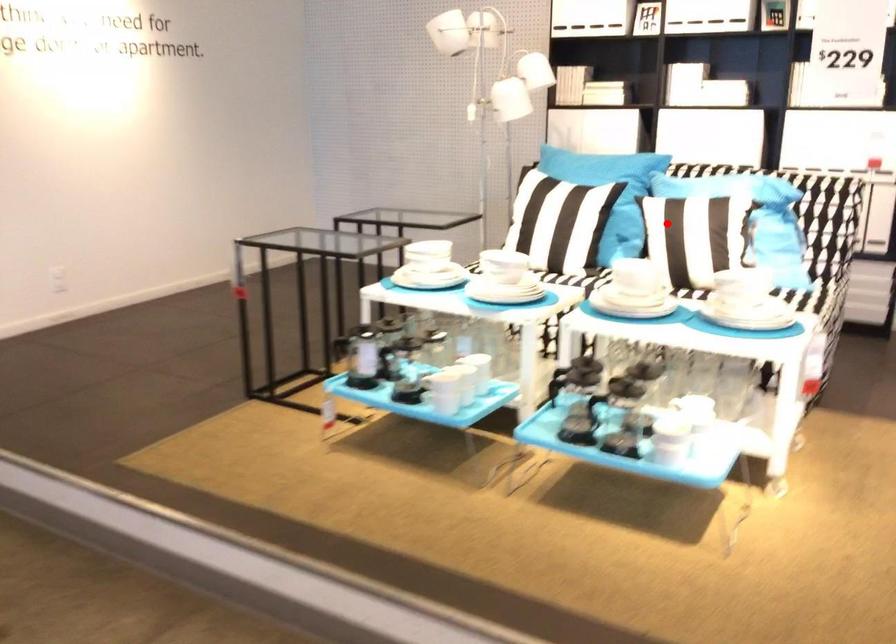
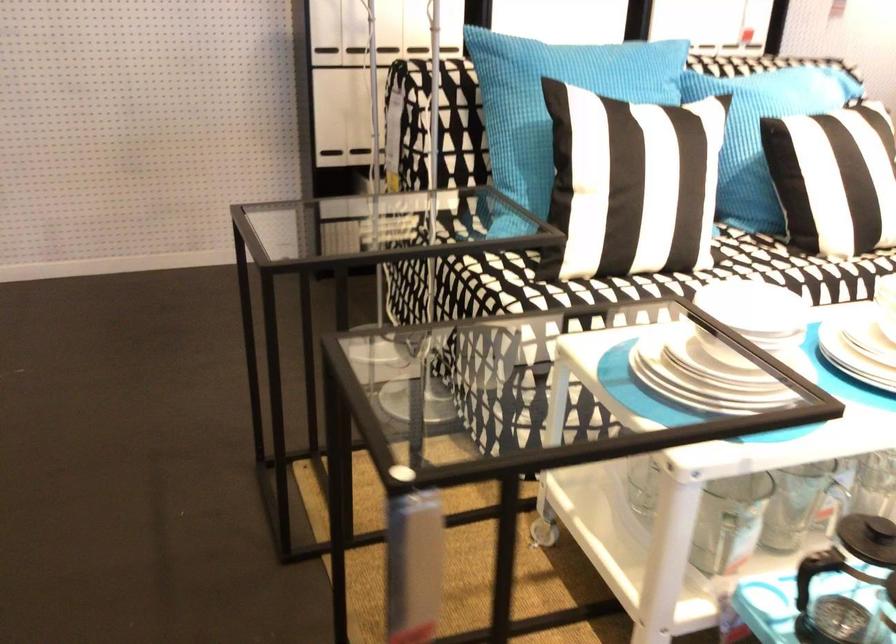
Question: I am providing you with two images of the same scene from different viewpoints. Given a red point in image1, look at the same physical point in image2. Is it:

Choices:
 (A) Closer to the viewpoint
 (B) Farther from the viewpoint

Answer: (A)